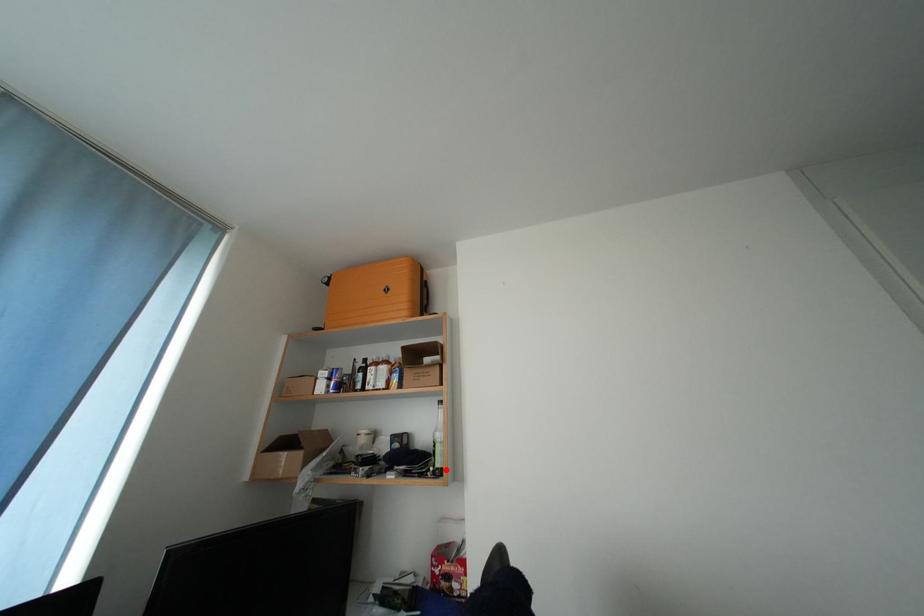
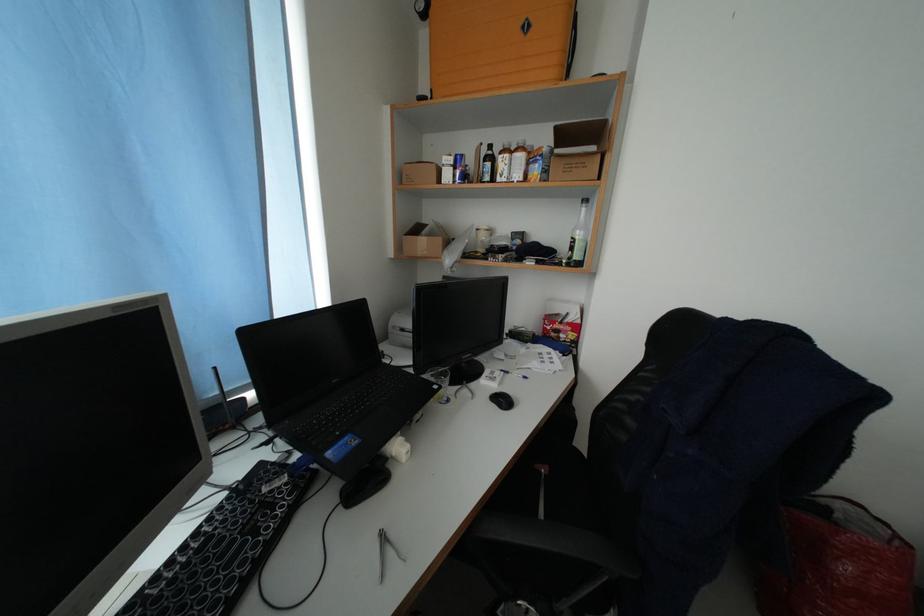
In the second image, find the point that corresponds to the highlighted location in the first image.

(582, 262)